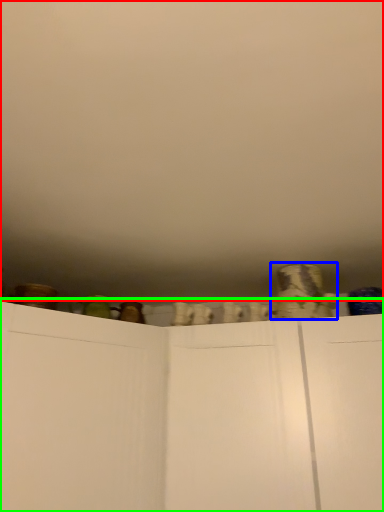
Question: Which object is positioned closest to backdrop (highlighted by a red box)? Select from pottery (highlighted by a blue box) and cupboard (highlighted by a green box).

Choices:
 (A) pottery
 (B) cupboard

Answer: (B)